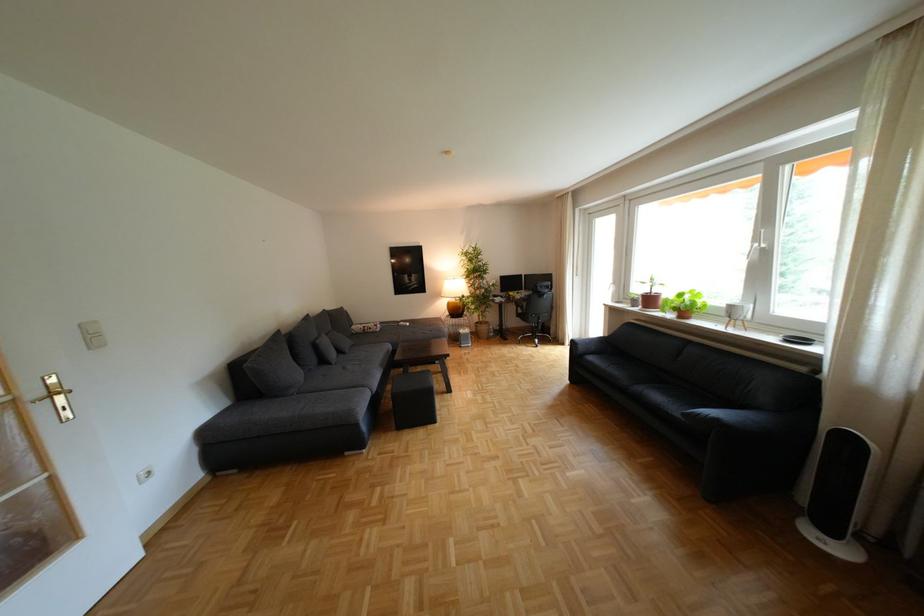
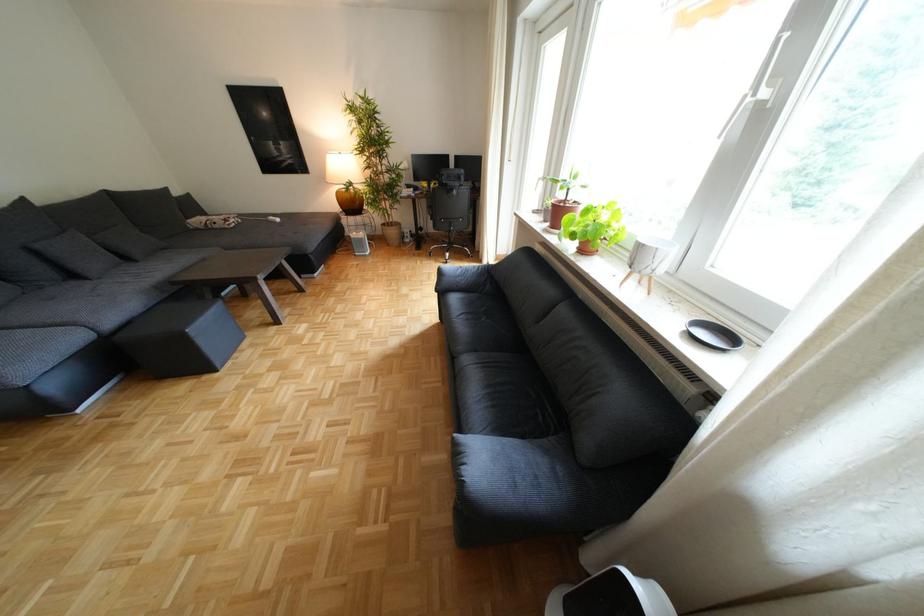
Where in the second image is the point corresponding to the point at 460,304 from the first image?

(351, 193)